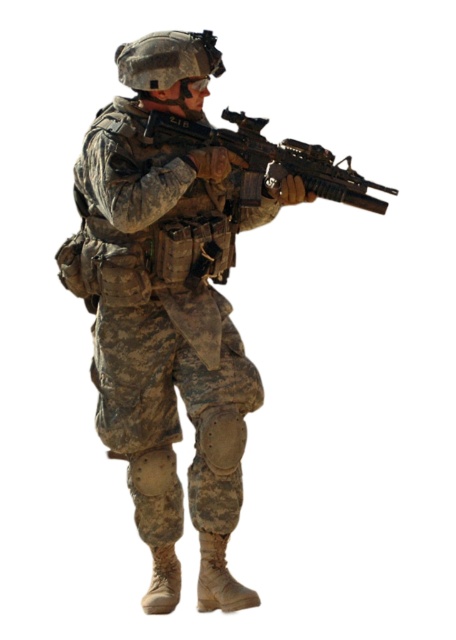
Question: Among these points, which one is farthest from the camera?

Choices:
 (A) (260, 193)
 (B) (155, 349)

Answer: (B)

Question: Which point is farther to the camera?

Choices:
 (A) (202, 365)
 (B) (284, 141)

Answer: (A)

Question: Does camouflage fabric uniform at center come in front of matte black rifle at center?

Choices:
 (A) yes
 (B) no

Answer: (B)

Question: Which point is closer to the camera?

Choices:
 (A) [x=236, y=138]
 (B) [x=84, y=269]

Answer: (A)

Question: Can you confirm if camouflage fabric uniform at center is thinner than matte black rifle at center?

Choices:
 (A) no
 (B) yes

Answer: (B)

Question: Observing the image, what is the correct spatial positioning of camouflage fabric uniform at center in reference to matte black rifle at center?

Choices:
 (A) above
 (B) below

Answer: (B)